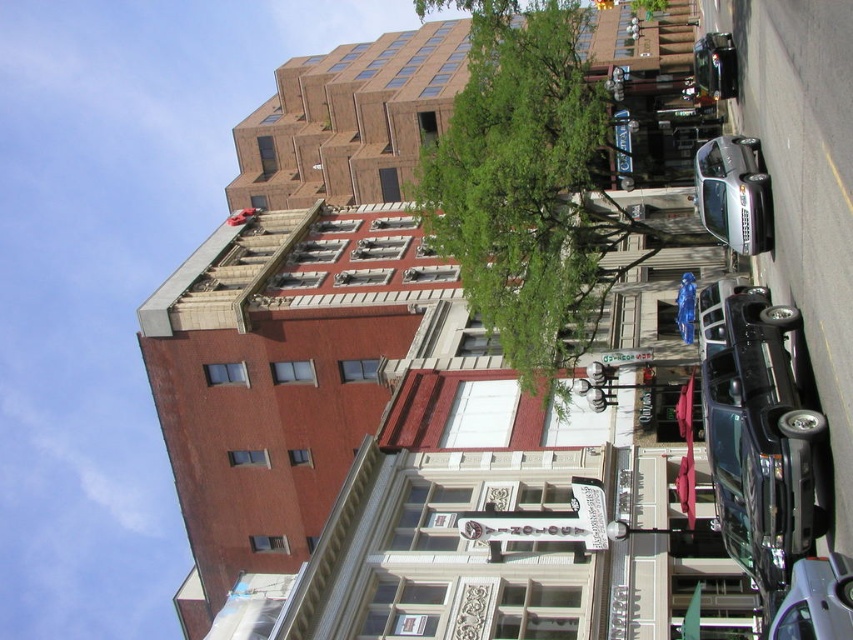
You are a delivery driver who needs to park your car between the two silver metallic sedans. Which sedan should you position your car next to, the silver metallic sedan at right or the metallic silver sedan at lower right, to ensure proper parking alignment?

You should position your car next to the metallic silver sedan at lower right because the silver metallic sedan at right is to the right of it, so parking next to the lower right one would allow proper alignment between the two sedans.

You are a delivery person needing to park your 2.5 meter wide truck between the green leafy tree at center and the silver metallic sedan at right. Can you fit your truck there?

The distance between the green leafy tree at center and the silver metallic sedan at right is 10.18 meters. Since your truck is 2.5 meters wide, there is sufficient space to park it between them.